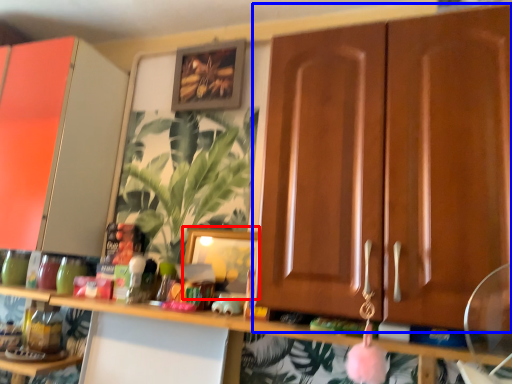
Question: Which point is closer to the camera, picture frame (highlighted by a red box) or cabinetry (highlighted by a blue box)?

Choices:
 (A) picture frame
 (B) cabinetry

Answer: (B)